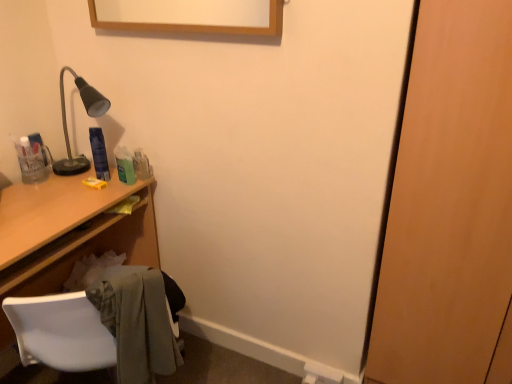
Question: From the image's perspective, is light gray fabric at lower left above blue plastic can at upper left?

Choices:
 (A) yes
 (B) no

Answer: (B)

Question: Does light gray fabric at lower left have a larger size compared to blue plastic can at upper left?

Choices:
 (A) yes
 (B) no

Answer: (A)

Question: Can we say light gray fabric at lower left lies outside blue plastic can at upper left?

Choices:
 (A) no
 (B) yes

Answer: (B)

Question: Does light gray fabric at lower left appear on the right side of blue plastic can at upper left?

Choices:
 (A) no
 (B) yes

Answer: (B)

Question: Is light gray fabric at lower left facing towards blue plastic can at upper left?

Choices:
 (A) yes
 (B) no

Answer: (A)

Question: Can you see light gray fabric at lower left touching blue plastic can at upper left?

Choices:
 (A) yes
 (B) no

Answer: (B)

Question: Considering the relative sizes of white plastic chair at lower left and light gray fabric at lower left in the image provided, is white plastic chair at lower left smaller than light gray fabric at lower left?

Choices:
 (A) yes
 (B) no

Answer: (A)

Question: Is white plastic chair at lower left positioned with its back to light gray fabric at lower left?

Choices:
 (A) no
 (B) yes

Answer: (A)

Question: Is white plastic chair at lower left positioned before light gray fabric at lower left?

Choices:
 (A) yes
 (B) no

Answer: (B)

Question: Is white plastic chair at lower left taller than light gray fabric at lower left?

Choices:
 (A) yes
 (B) no

Answer: (B)

Question: Is white plastic chair at lower left further to the viewer compared to light gray fabric at lower left?

Choices:
 (A) yes
 (B) no

Answer: (A)

Question: From the image's perspective, is white plastic chair at lower left located beneath light gray fabric at lower left?

Choices:
 (A) yes
 (B) no

Answer: (A)

Question: From the image's perspective, is wooden desk at left below blue plastic can at upper left?

Choices:
 (A) no
 (B) yes

Answer: (B)